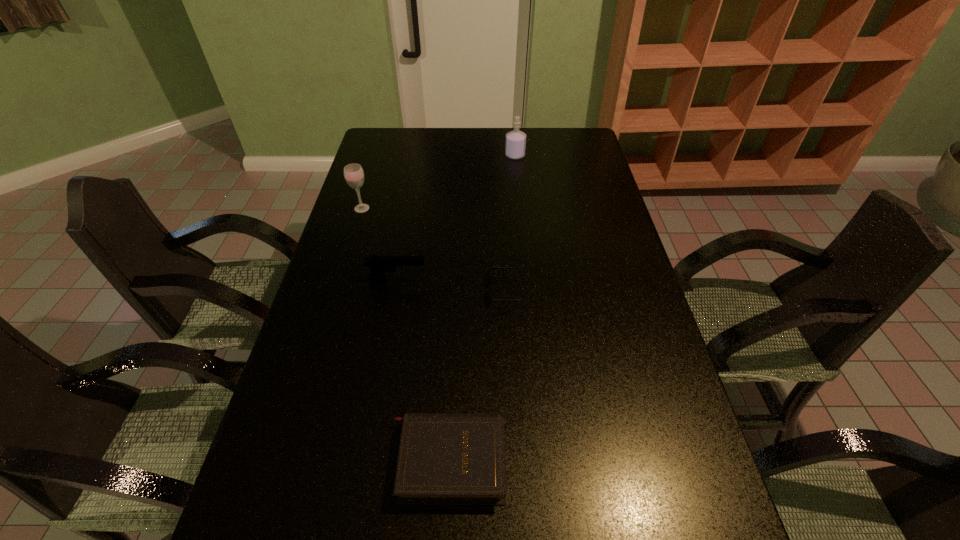
This screenshot has height=540, width=960. In order to click on perfume in this screenshot , I will do `click(515, 145)`.

Find the location of `the leftmost object`. the leftmost object is located at coordinates (353, 173).

The image size is (960, 540). In order to click on the second farthest object in this screenshot , I will do `click(353, 173)`.

You are a GUI agent. You are given a task and a screenshot of the screen. Output one action in this format:
    pyautogui.click(x=<x>, y=<y>)
    Task: Click on the third tallest object
    This screenshot has height=540, width=960.
    Given the screenshot: What is the action you would take?
    pyautogui.click(x=379, y=264)

At what (x,y) coordinates should I click in order to perform the action: click on Bible. Please return your answer as a coordinate pair (x, y). Looking at the image, I should click on (444, 458).

Locate an element on the screen. This screenshot has height=540, width=960. sunglasses is located at coordinates (493, 300).

Where is `vacant space located on the right of the perfume`? This screenshot has width=960, height=540. vacant space located on the right of the perfume is located at coordinates (548, 156).

Identify the location of free space located on the front of the wineglass. (349, 250).

Identify the location of vacant area situated on the front-facing side of the third tallest object. Image resolution: width=960 pixels, height=540 pixels. (455, 280).

Locate an element on the screen. free location located on the back of the Bible is located at coordinates (455, 345).